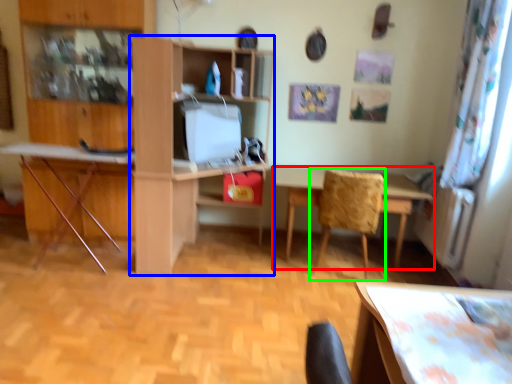
Question: Based on their relative distances, which object is farther from table (highlighted by a red box)? Choose from shelf (highlighted by a blue box) and chair (highlighted by a green box).

Choices:
 (A) shelf
 (B) chair

Answer: (A)